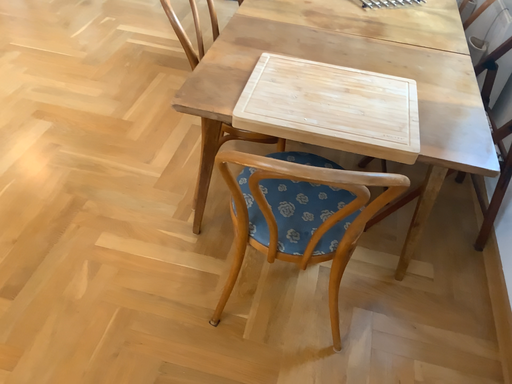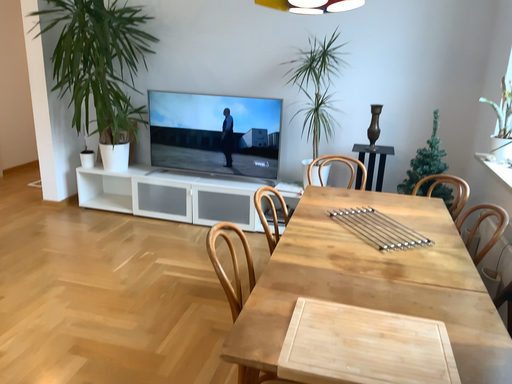
Question: How did the camera likely rotate when shooting the video?

Choices:
 (A) rotated downward
 (B) rotated upward

Answer: (B)